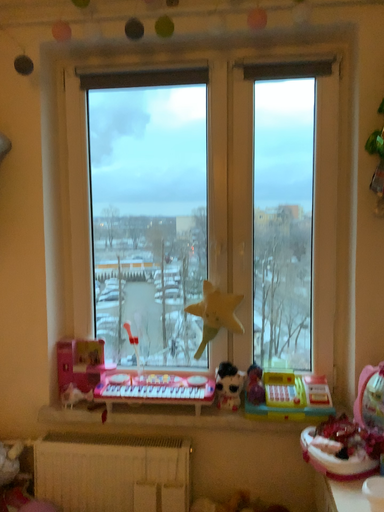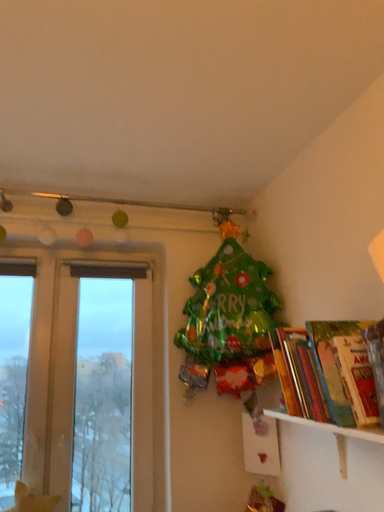
Question: How did the camera likely rotate when shooting the video?

Choices:
 (A) rotated left
 (B) rotated right

Answer: (B)